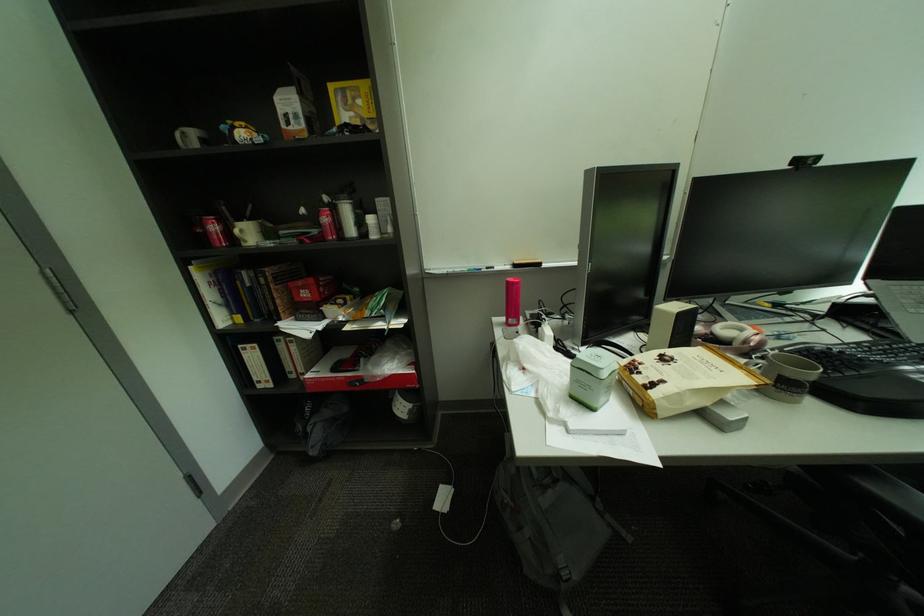
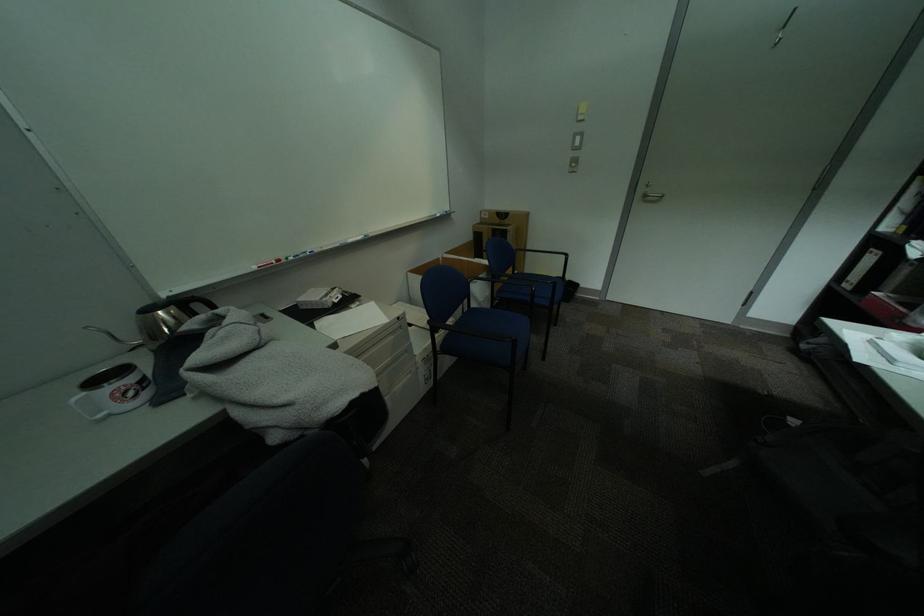
Where in the second image is the point corresponding to [265,379] from the first image?

(859, 280)